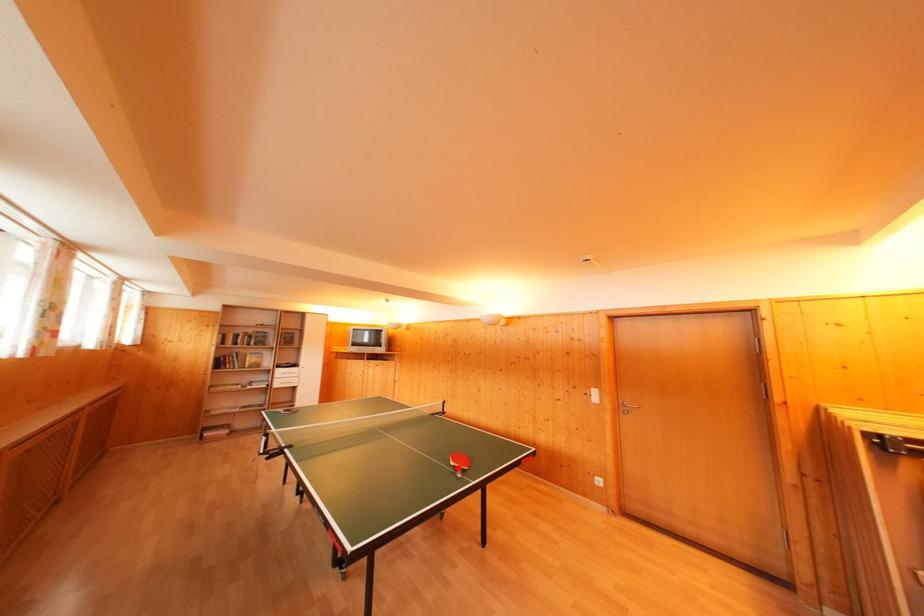
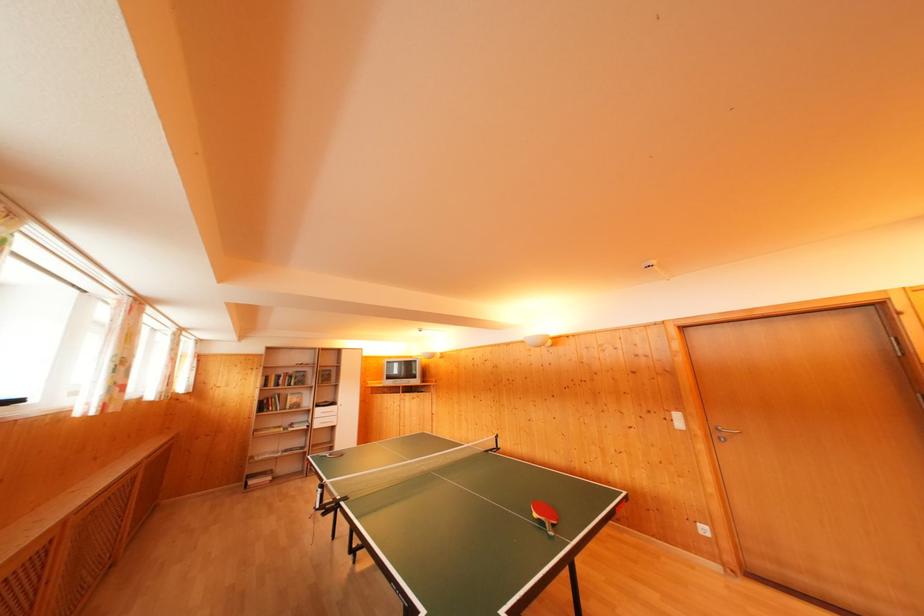
Question: I am providing you with two images of the same scene from different viewpoints. A red point is shown in image1. For the corresponding object point in image2, is it positioned nearer or farther from the camera?

Choices:
 (A) Nearer
 (B) Farther

Answer: (B)